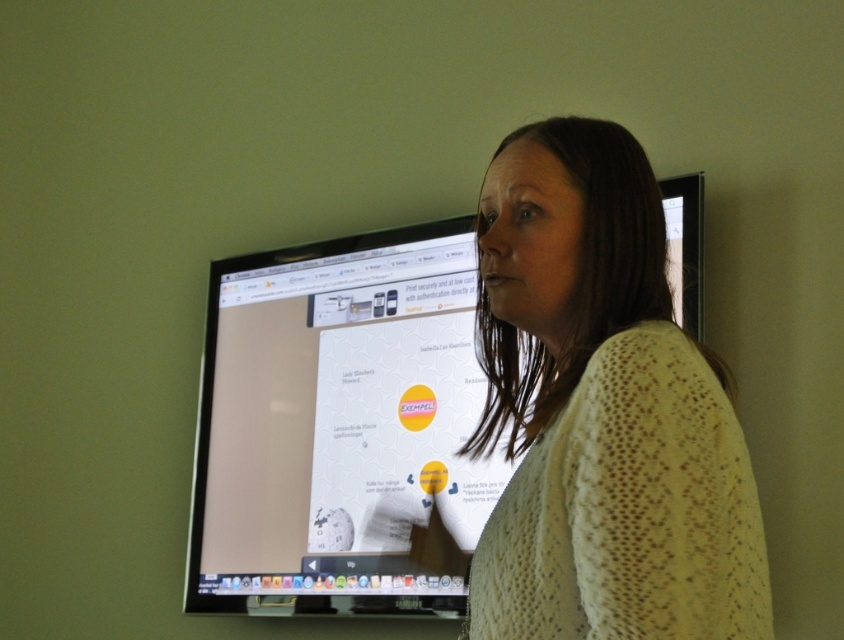
You are an interior designer assessing the room layout. The knitted yellow sweater at center and the matte black monitor at center are both in the foreground. Which object takes up more space in the visual field?

The matte black monitor at center takes up more space in the visual field since it is larger than the knitted yellow sweater at center according to the description.

You are an interior designer evaluating the layout of a living room. You notice the knitted yellow sweater at center and the matte black monitor at center. Based on their heights, which item would you recommend placing on a lower shelf to maintain visual balance?

The knitted yellow sweater at center has a lesser height compared to the matte black monitor at center, so placing the knitted yellow sweater at center on a lower shelf would help maintain visual balance by positioning the shorter item where it can be seen without being overshadowed.